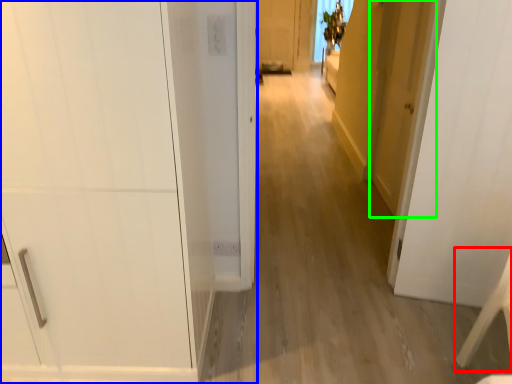
Question: Based on their relative distances, which object is nearer to furniture (highlighted by a red box)? Choose from door (highlighted by a blue box) and door (highlighted by a green box).

Choices:
 (A) door
 (B) door

Answer: (B)